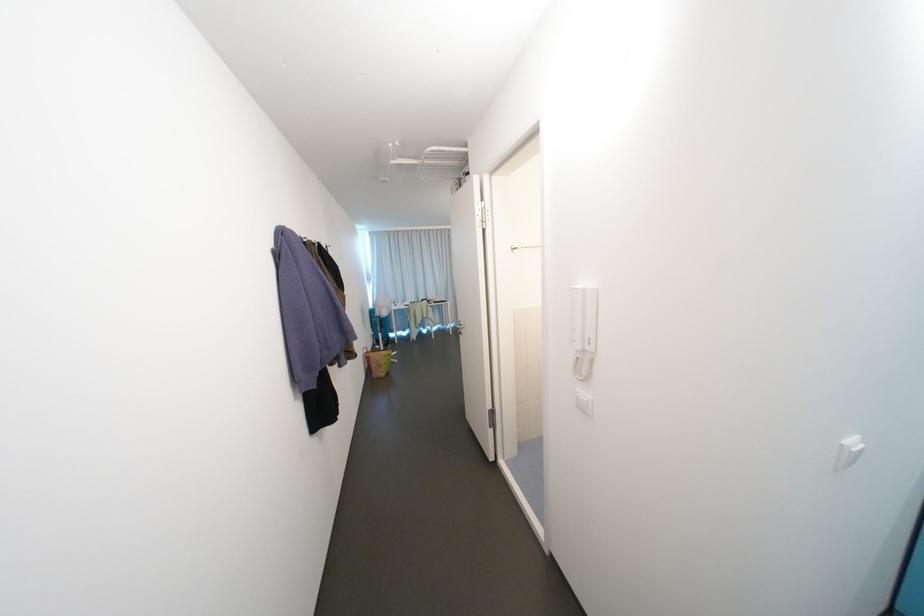
Where is `white light switch`? This screenshot has width=924, height=616. white light switch is located at coordinates (848, 452).